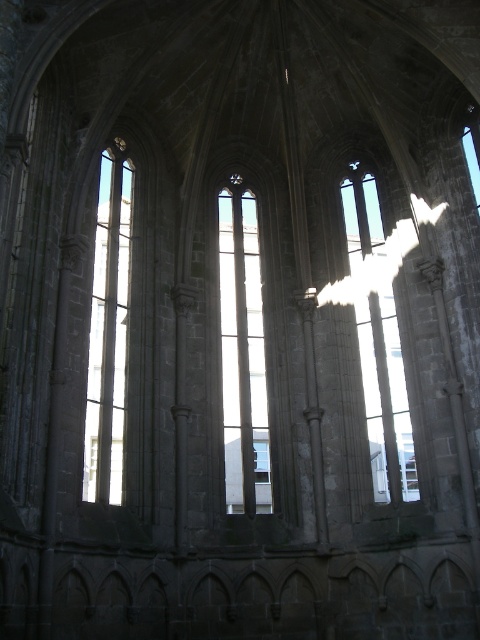
Which is above, clear glass window at center or clear glass window at left?

Positioned higher is clear glass window at left.

Between point (263, 468) and point (120, 280), which one is positioned in front?

Point (263, 468) is in front.

Which is in front, point (227, 324) or point (96, 342)?

Point (96, 342) is in front.

The height and width of the screenshot is (640, 480). I want to click on clear glass window at center, so click(242, 355).

Does transparent glass window at center have a lesser width compared to clear glass window at left?

Yes, transparent glass window at center is thinner than clear glass window at left.

Which is more to the right, transparent glass window at center or clear glass window at left?

From the viewer's perspective, transparent glass window at center appears more on the right side.

Between point (408, 493) and point (126, 253), which one is positioned in front?

Point (408, 493)

Find the location of a particular element. transparent glass window at center is located at coordinates (379, 342).

Is clear glass window at center further to camera compared to transparent glass window at center?

Yes.

Which is in front, point (235, 468) or point (375, 314)?

Positioned in front is point (235, 468).

Locate an element on the screen. This screenshot has height=640, width=480. clear glass window at center is located at coordinates (242, 355).